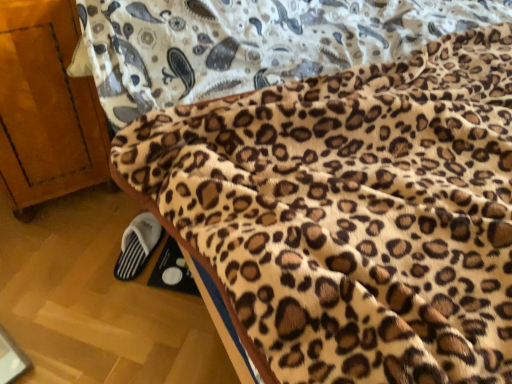
Locate an element on the screen. The height and width of the screenshot is (384, 512). vacant area that lies in front of white fabric slipper at lower left is located at coordinates (122, 299).